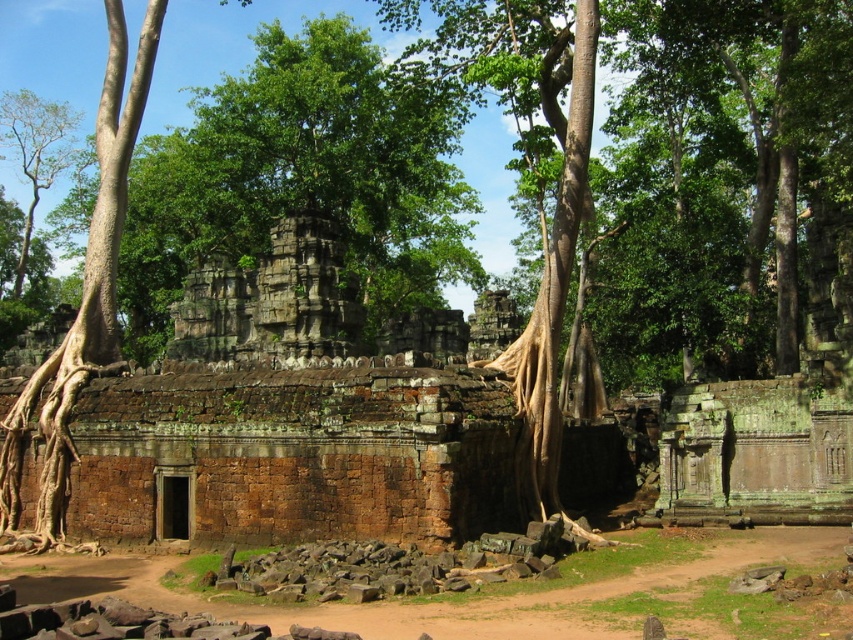
You are an archaeologist examining the ancient stone structure. You notice the brown rough tree roots at left and the green leafy tree at upper left. Which of these two objects is larger in size?

The green leafy tree at upper left is larger than the brown rough tree roots at left.

You are standing at the ancient stone structure and want to walk towards the point labeled as point (6,100). Which direction should you move relative to point (78,310)?

You should move towards the direction of point (6,100), which is behind point (78,310) since point (78,310) is in front of point (6,100).

Based on the photo, you are an archaeologist examining the ancient stone structure. You notice the brown rough tree roots at left and the green leafy tree at upper left. Which of these two objects is shorter in height?

The brown rough tree roots at left is not as tall as the green leafy tree at upper left, so the brown rough tree roots at left is shorter in height.